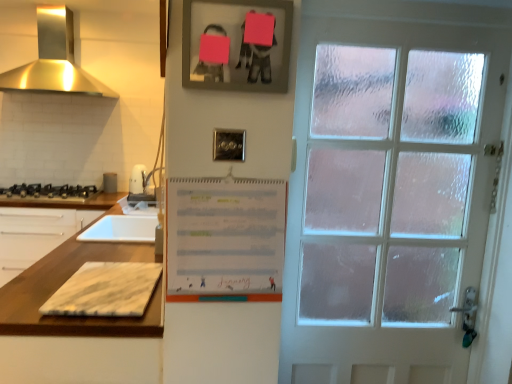
Question: From a real-world perspective, is metallic silver toaster at left below marble cutting board at lower left?

Choices:
 (A) yes
 (B) no

Answer: (B)

Question: Is metallic silver toaster at left turned away from marble cutting board at lower left?

Choices:
 (A) yes
 (B) no

Answer: (B)

Question: From the image's perspective, is metallic silver toaster at left on marble cutting board at lower left?

Choices:
 (A) no
 (B) yes

Answer: (B)

Question: Is metallic silver toaster at left positioned beyond the bounds of marble cutting board at lower left?

Choices:
 (A) yes
 (B) no

Answer: (A)

Question: Is metallic silver toaster at left oriented towards marble cutting board at lower left?

Choices:
 (A) yes
 (B) no

Answer: (A)

Question: From the image's perspective, is black matte gas stove at left positioned above or below white marble cutting board at left?

Choices:
 (A) below
 (B) above

Answer: (B)

Question: Would you say black matte gas stove at left is to the left or to the right of white marble cutting board at left in the picture?

Choices:
 (A) left
 (B) right

Answer: (B)

Question: Is black matte gas stove at left spatially inside white marble cutting board at left, or outside of it?

Choices:
 (A) inside
 (B) outside

Answer: (B)

Question: Is point (46, 195) closer or farther from the camera than point (60, 261)?

Choices:
 (A) closer
 (B) farther

Answer: (B)

Question: Considering the positions of metallic silver toaster at left and satin gold stainless steel exhaust hood at upper left in the image, is metallic silver toaster at left wider or thinner than satin gold stainless steel exhaust hood at upper left?

Choices:
 (A) thin
 (B) wide

Answer: (A)

Question: Is metallic silver toaster at left in front of or behind satin gold stainless steel exhaust hood at upper left in the image?

Choices:
 (A) behind
 (B) front

Answer: (A)

Question: Does point click(x=138, y=168) appear closer or farther from the camera than point click(x=117, y=96)?

Choices:
 (A) farther
 (B) closer

Answer: (A)

Question: Choose the correct answer: Is metallic silver toaster at left inside satin gold stainless steel exhaust hood at upper left or outside it?

Choices:
 (A) outside
 (B) inside

Answer: (A)

Question: From a real-world perspective, relative to satin gold stainless steel exhaust hood at upper left, is white marble cutting board at left vertically above or below?

Choices:
 (A) below
 (B) above

Answer: (A)

Question: From the image's perspective, is white marble cutting board at left above or below satin gold stainless steel exhaust hood at upper left?

Choices:
 (A) below
 (B) above

Answer: (A)